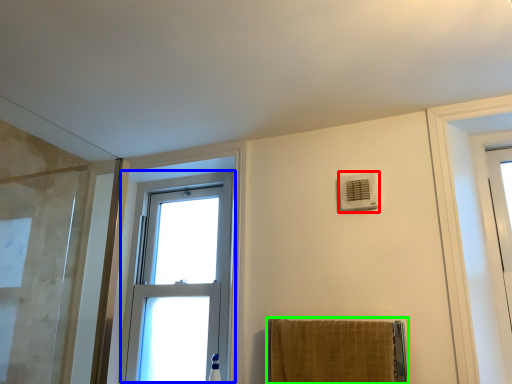
Question: Which is nearer to the air conditioning (highlighted by a red box)? window (highlighted by a blue box) or towel (highlighted by a green box).

Choices:
 (A) window
 (B) towel

Answer: (B)